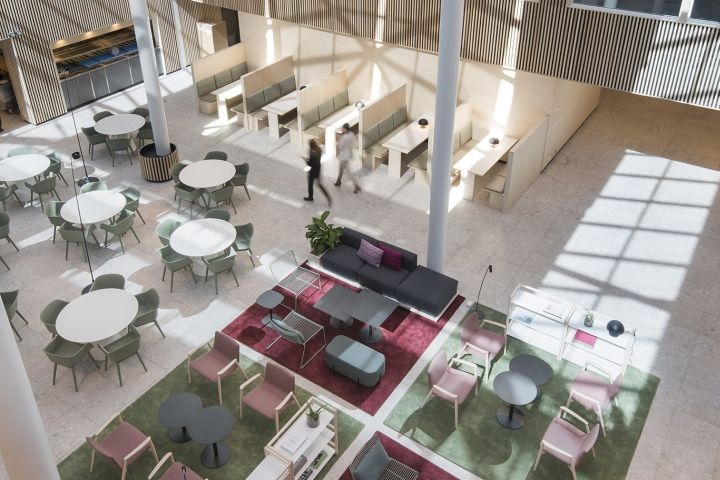
Identify the location of banquette. The image size is (720, 480). (526, 153), (463, 135), (372, 120), (312, 100), (266, 83), (211, 78).